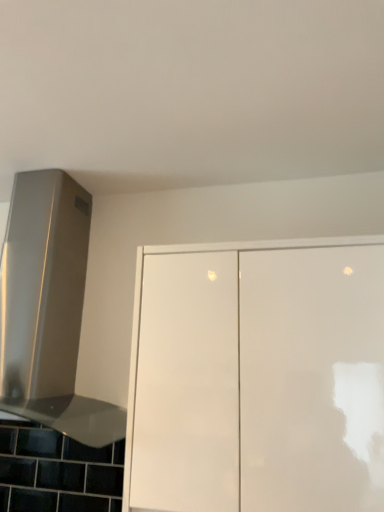
This screenshot has height=512, width=384. What do you see at coordinates (257, 377) in the screenshot?
I see `white glossy cabinet at center` at bounding box center [257, 377].

Image resolution: width=384 pixels, height=512 pixels. I want to click on white glossy cabinet at center, so click(x=257, y=377).

The image size is (384, 512). What are the coordinates of `satin silver vent at upper left` in the screenshot? It's located at (48, 308).

Describe the element at coordinates (48, 308) in the screenshot. I see `satin silver vent at upper left` at that location.

Measure the distance between point (14,183) and camera.

The depth of point (14,183) is 1.67 meters.

Where is `white glossy cabinet at center`? This screenshot has height=512, width=384. white glossy cabinet at center is located at coordinates (257, 377).

Considering the positions of objects white glossy cabinet at center and satin silver vent at upper left in the image provided, who is more to the left, white glossy cabinet at center or satin silver vent at upper left?

satin silver vent at upper left is more to the left.

Between white glossy cabinet at center and satin silver vent at upper left, which one is positioned in front?

white glossy cabinet at center is in front.

Which is in front, point (249, 477) or point (64, 249)?

The point (249, 477) is closer.

From the image's perspective, is white glossy cabinet at center located beneath satin silver vent at upper left?

Indeed, from the image's perspective, white glossy cabinet at center is shown beneath satin silver vent at upper left.

Consider the image. From a real-world perspective, which is physically below, white glossy cabinet at center or satin silver vent at upper left?

In real-world perspective, white glossy cabinet at center is lower.

Is white glossy cabinet at center wider than satin silver vent at upper left?

Incorrect, the width of white glossy cabinet at center does not surpass that of satin silver vent at upper left.

Who is shorter, white glossy cabinet at center or satin silver vent at upper left?

Standing shorter between the two is white glossy cabinet at center.

In terms of size, does white glossy cabinet at center appear bigger or smaller than satin silver vent at upper left?

white glossy cabinet at center is smaller than satin silver vent at upper left.

Looking at this image, is white glossy cabinet at center situated inside satin silver vent at upper left or outside?

white glossy cabinet at center is located beyond the bounds of satin silver vent at upper left.

Are white glossy cabinet at center and satin silver vent at upper left far apart?

No, white glossy cabinet at center is not far from satin silver vent at upper left.

Is white glossy cabinet at center looking in the opposite direction of satin silver vent at upper left?

That's not correct — white glossy cabinet at center is not looking away from satin silver vent at upper left.

Can you tell me how much white glossy cabinet at center and satin silver vent at upper left differ in facing direction?

1.34 degrees.

This screenshot has width=384, height=512. Find the location of `vent behind the white glossy cabinet at center`. vent behind the white glossy cabinet at center is located at coordinates (48, 308).

Looking at this image, considering the positions of objects satin silver vent at upper left and white glossy cabinet at center in the image provided, who is more to the left, satin silver vent at upper left or white glossy cabinet at center?

satin silver vent at upper left is more to the left.

Looking at this image, considering the positions of objects satin silver vent at upper left and white glossy cabinet at center in the image provided, who is in front, satin silver vent at upper left or white glossy cabinet at center?

white glossy cabinet at center is closer to the camera.

Is point (65, 428) positioned after point (242, 264)?

Yes.

From the image's perspective, which is above, satin silver vent at upper left or white glossy cabinet at center?

satin silver vent at upper left appears higher in the image.

From a real-world perspective, is satin silver vent at upper left above or below white glossy cabinet at center?

satin silver vent at upper left is above white glossy cabinet at center.

Considering the sizes of satin silver vent at upper left and white glossy cabinet at center in the image, is satin silver vent at upper left wider or thinner than white glossy cabinet at center?

Considering their sizes, satin silver vent at upper left looks broader than white glossy cabinet at center.

Can you confirm if satin silver vent at upper left is shorter than white glossy cabinet at center?

In fact, satin silver vent at upper left may be taller than white glossy cabinet at center.

Looking at this image, considering the relative sizes of satin silver vent at upper left and white glossy cabinet at center in the image provided, is satin silver vent at upper left bigger than white glossy cabinet at center?

Indeed, satin silver vent at upper left has a larger size compared to white glossy cabinet at center.

Is satin silver vent at upper left inside or outside of white glossy cabinet at center?

satin silver vent at upper left is outside white glossy cabinet at center.

Are satin silver vent at upper left and white glossy cabinet at center located far from each other?

No, there isn't a large distance between satin silver vent at upper left and white glossy cabinet at center.

Is white glossy cabinet at center at the back of satin silver vent at upper left?

No, white glossy cabinet at center is not at the back of satin silver vent at upper left.

What's the angular difference between satin silver vent at upper left and white glossy cabinet at center's facing directions?

The angular difference between satin silver vent at upper left and white glossy cabinet at center is 1.34 degrees.

Image resolution: width=384 pixels, height=512 pixels. In order to click on cabinetry below the satin silver vent at upper left (from the image's perspective) in this screenshot , I will do `click(257, 377)`.

The width and height of the screenshot is (384, 512). I want to click on cabinetry below the satin silver vent at upper left (from a real-world perspective), so click(257, 377).

Find the location of a particular element. The height and width of the screenshot is (512, 384). vent that appears above the white glossy cabinet at center (from a real-world perspective) is located at coordinates (48, 308).